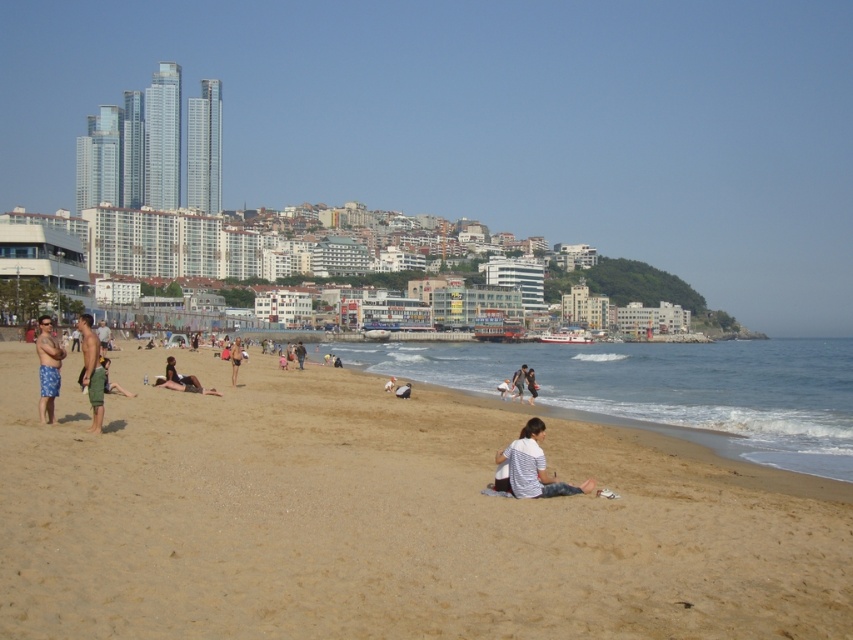
Question: Which point is farther from the camera taking this photo?

Choices:
 (A) (x=73, y=404)
 (B) (x=100, y=429)

Answer: (A)

Question: Which point is farther from the camera taking this photo?

Choices:
 (A) (231, 374)
 (B) (119, 417)
 (C) (50, 337)

Answer: (A)

Question: Is white cotton shirt at center to the left of dark gray fabric pants at lower center from the viewer's perspective?

Choices:
 (A) no
 (B) yes

Answer: (A)

Question: Which point is closer to the camera taking this photo?

Choices:
 (A) (234, 365)
 (B) (585, 490)

Answer: (B)

Question: Does white striped shirt at center come in front of white cotton shirt at center?

Choices:
 (A) no
 (B) yes

Answer: (B)

Question: Does brown sandy beach at center have a greater width compared to green fabric shorts at center?

Choices:
 (A) no
 (B) yes

Answer: (B)